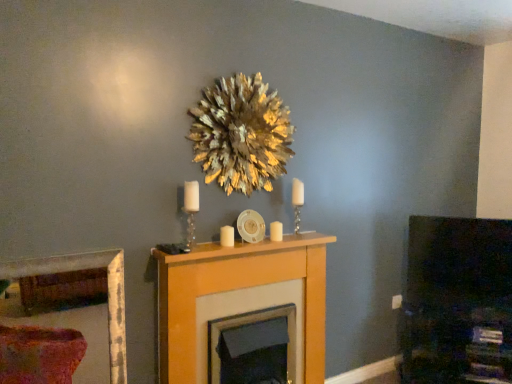
Identify the location of free space between clear glass candle holder at center, placed as the second candle holder when sorted from back to front, and white matte candle at center, which ranks as the 2th candle in back-to-front order. The image size is (512, 384). (207, 251).